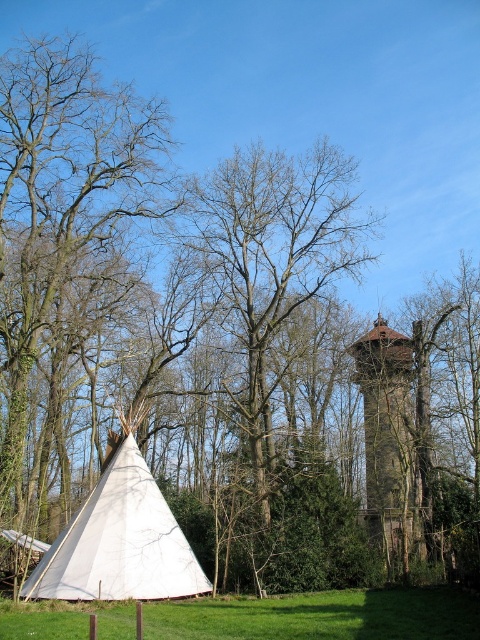
Question: Which object is farther from the camera taking this photo?

Choices:
 (A) bare wood tree at center
 (B) smooth bark tree at left

Answer: (B)

Question: Does white canvas tent at lower left have a greater width compared to brown stone tower at center right?

Choices:
 (A) yes
 (B) no

Answer: (A)

Question: Is bare wood tree at center thinner than white canvas tent at lower left?

Choices:
 (A) yes
 (B) no

Answer: (B)

Question: Which of the following is the closest to the observer?

Choices:
 (A) bare wood tree at center
 (B) brown stone tower at center right
 (C) smooth bark tree at left

Answer: (B)

Question: Considering the real-world distances, which object is farthest from the bare wood tree at center?

Choices:
 (A) smooth bark tree at left
 (B) green grass at lower left
 (C) white canvas tent at lower left
 (D) brown stone tower at center right

Answer: (B)

Question: Considering the relative positions of green grass at lower left and brown stone tower at center right in the image provided, where is green grass at lower left located with respect to brown stone tower at center right?

Choices:
 (A) right
 (B) left

Answer: (B)